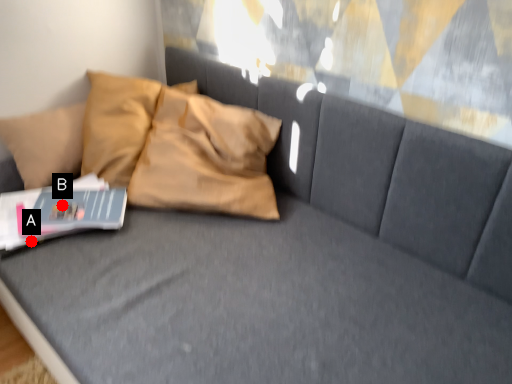
Question: Two points are circled on the image, labeled by A and B beside each circle. Which point is farther to the camera?

Choices:
 (A) A is further
 (B) B is further

Answer: (B)